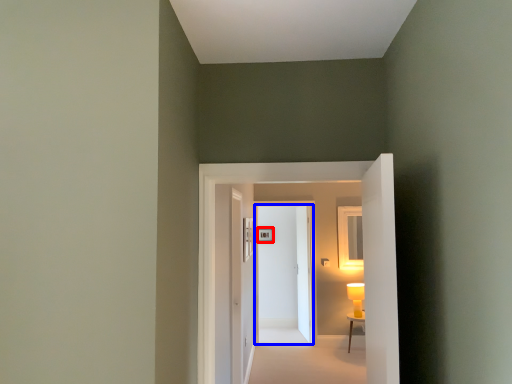
Question: Which object appears farthest to the camera in this image, picture frame (highlighted by a red box) or door (highlighted by a blue box)?

Choices:
 (A) picture frame
 (B) door

Answer: (A)